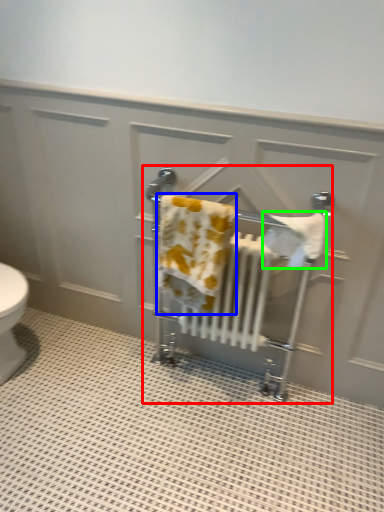
Question: Estimate the real-world distances between objects in this image. Which object is closer to baby carriage (highlighted by a red box), bath towel (highlighted by a blue box) or bath towel (highlighted by a green box)?

Choices:
 (A) bath towel
 (B) bath towel

Answer: (B)